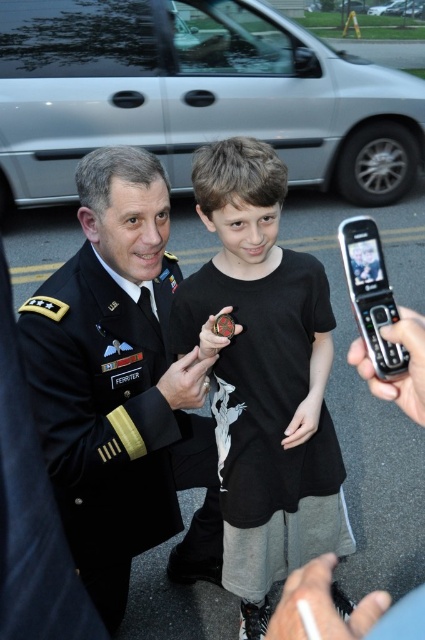
You are a photographer standing at the edge of the parking lot. You need to capture a closeup shot of both the black matte shirt at center and the black wool military uniform at center in the same frame. Can you fit both into your camera viewfinder without zooming out?

The black matte shirt at center is 11.30 inches from the black wool military uniform at center, so yes, both can be captured in the same frame without zooming out since the distance between them is relatively small.

You are a photographer standing in front of the two individuals in the image. You want to take a photo that captures both the black matte shirt at center and the black wool military uniform at center clearly. Which one should you focus on first to ensure both are in focus?

You should focus on the black wool military uniform at center first because it is farther away than the black matte shirt at center, ensuring both will be in focus when using a camera with a fixed focal plane.